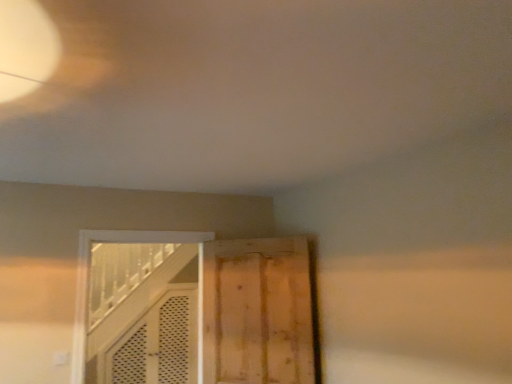
Question: Which direction should I rotate to look at white wooden door at center, the 1th door in the left-to-right sequence, — up or down?

Choices:
 (A) down
 (B) up

Answer: (A)

Question: From the image's perspective, would you say white wooden door at center, the second door in the right-to-left sequence, is positioned over wooden door at center, positioned as the first door in right-to-left order?

Choices:
 (A) yes
 (B) no

Answer: (B)

Question: From a real-world perspective, is white wooden door at center, the 1th door in the left-to-right sequence, beneath wooden door at center, acting as the second door starting from the left?

Choices:
 (A) yes
 (B) no

Answer: (B)

Question: Can you confirm if white wooden door at center, the 1th door in the left-to-right sequence, is positioned to the left of wooden door at center, positioned as the first door in right-to-left order?

Choices:
 (A) yes
 (B) no

Answer: (A)

Question: Is the position of white wooden door at center, the 1th door in the left-to-right sequence, more distant than that of wooden door at center, acting as the second door starting from the left?

Choices:
 (A) no
 (B) yes

Answer: (A)

Question: Would you say wooden door at center, positioned as the first door in right-to-left order, is part of white wooden door at center, the 1th door in the left-to-right sequence,'s contents?

Choices:
 (A) no
 (B) yes

Answer: (A)

Question: Is the surface of white wooden door at center, the 1th door in the left-to-right sequence, in direct contact with wooden door at center, acting as the second door starting from the left?

Choices:
 (A) no
 (B) yes

Answer: (A)

Question: Is wooden door at center, positioned as the first door in right-to-left order, far from white wooden door at center, the second door in the right-to-left sequence?

Choices:
 (A) yes
 (B) no

Answer: (A)

Question: From the image's perspective, does wooden door at center, acting as the second door starting from the left, appear higher than white wooden door at center, the second door in the right-to-left sequence?

Choices:
 (A) yes
 (B) no

Answer: (A)

Question: Considering the relative sizes of wooden door at center, positioned as the first door in right-to-left order, and white wooden door at center, the second door in the right-to-left sequence, in the image provided, is wooden door at center, positioned as the first door in right-to-left order, shorter than white wooden door at center, the second door in the right-to-left sequence,?

Choices:
 (A) no
 (B) yes

Answer: (B)

Question: Does wooden door at center, positioned as the first door in right-to-left order, have a greater height compared to white wooden door at center, the second door in the right-to-left sequence?

Choices:
 (A) yes
 (B) no

Answer: (B)

Question: Is white wooden door at center, the second door in the right-to-left sequence, completely or partially inside wooden door at center, positioned as the first door in right-to-left order?

Choices:
 (A) no
 (B) yes

Answer: (A)

Question: Is wooden door at center, positioned as the first door in right-to-left order, positioned in front of white wooden door at center, the 1th door in the left-to-right sequence?

Choices:
 (A) no
 (B) yes

Answer: (A)

Question: Considering the positions of point (183, 281) and point (250, 283), is point (183, 281) closer or farther from the camera than point (250, 283)?

Choices:
 (A) farther
 (B) closer

Answer: (A)